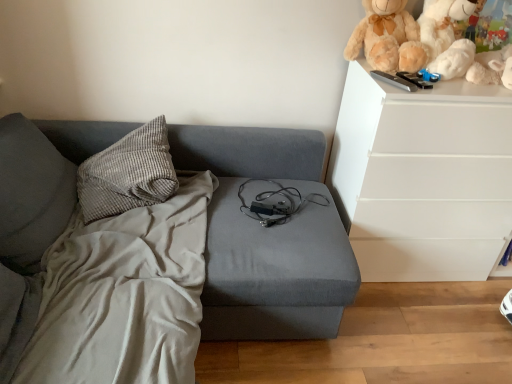
Describe the element at coordinates (460, 47) in the screenshot. This screenshot has height=384, width=512. I see `white plush toy at upper right` at that location.

What do you see at coordinates (387, 38) in the screenshot? I see `fluffy beige teddy bear at upper right` at bounding box center [387, 38].

Locate an element on the screen. The width and height of the screenshot is (512, 384). gray corduroy pillow at upper left is located at coordinates (128, 173).

Image resolution: width=512 pixels, height=384 pixels. Describe the element at coordinates (442, 23) in the screenshot. I see `white plush teddy bear at upper right` at that location.

Image resolution: width=512 pixels, height=384 pixels. Identify the location of white plush toy at upper right. (460, 47).

Which of these two, fluffy beige teddy bear at upper right or white plush toy at upper right, stands shorter?

Standing shorter between the two is fluffy beige teddy bear at upper right.

From a real-world perspective, is fluffy beige teddy bear at upper right physically above white plush toy at upper right?

Incorrect, from a real-world perspective, fluffy beige teddy bear at upper right is lower than white plush toy at upper right.

Is fluffy beige teddy bear at upper right far from white plush toy at upper right?

Actually, fluffy beige teddy bear at upper right and white plush toy at upper right are a little close together.

Based on their sizes in the image, would you say fluffy beige teddy bear at upper right is bigger or smaller than white plush toy at upper right?

fluffy beige teddy bear at upper right is smaller than white plush toy at upper right.

Is gray corduroy pillow at upper left turned away from white plush toy at upper right?

No, gray corduroy pillow at upper left is not facing the opposite direction of white plush toy at upper right.

Which is behind, gray corduroy pillow at upper left or white plush toy at upper right?

Positioned behind is white plush toy at upper right.

From a real-world perspective, which object stands above the other?

white plush toy at upper right.

Which of these two, gray corduroy pillow at upper left or white plush toy at upper right, stands shorter?

With less height is gray corduroy pillow at upper left.

Which is more to the left, white plush toy at upper right or white plush teddy bear at upper right?

white plush toy at upper right.

Is white plush toy at upper right wider than white plush teddy bear at upper right?

Correct, the width of white plush toy at upper right exceeds that of white plush teddy bear at upper right.

Considering the relative sizes of white plush toy at upper right and white plush teddy bear at upper right in the image provided, is white plush toy at upper right taller than white plush teddy bear at upper right?

Yes, white plush toy at upper right is taller than white plush teddy bear at upper right.

How many degrees apart are the facing directions of white plush toy at upper right and white plush teddy bear at upper right?

The angular difference between white plush toy at upper right and white plush teddy bear at upper right is 2.06 degrees.

Considering the positions of points (424, 43) and (161, 161), is point (424, 43) closer to camera compared to point (161, 161)?

Yes, it is in front of point (161, 161).

Could gray corduroy pillow at upper left be considered to be inside white plush teddy bear at upper right?

Definitely not — gray corduroy pillow at upper left is not inside white plush teddy bear at upper right.

I want to click on pillow below the white plush teddy bear at upper right (from the image's perspective), so click(128, 173).

Considering the relative sizes of white plush toy at upper right and fluffy beige teddy bear at upper right in the image provided, is white plush toy at upper right taller than fluffy beige teddy bear at upper right?

Yes, white plush toy at upper right is taller than fluffy beige teddy bear at upper right.

Between white plush toy at upper right and fluffy beige teddy bear at upper right, which one has larger size?

white plush toy at upper right.

Is point (361, 38) positioned after point (384, 41)?

Yes, it is.

From the image's perspective, would you say white plush toy at upper right is shown under fluffy beige teddy bear at upper right?

Yes.

Is gray corduroy pillow at upper left touching fluffy beige teddy bear at upper right?

gray corduroy pillow at upper left is not next to fluffy beige teddy bear at upper right, and they're not touching.

Can you tell me how much gray corduroy pillow at upper left and fluffy beige teddy bear at upper right differ in facing direction?

0.794 degrees separate the facing orientations of gray corduroy pillow at upper left and fluffy beige teddy bear at upper right.

Looking at this image, is gray corduroy pillow at upper left turned away from fluffy beige teddy bear at upper right?

No, gray corduroy pillow at upper left's orientation is not away from fluffy beige teddy bear at upper right.

From the image's perspective, is gray corduroy pillow at upper left above or below fluffy beige teddy bear at upper right?

gray corduroy pillow at upper left is situated lower than fluffy beige teddy bear at upper right in the image.

Is white plush toy at upper right next to gray corduroy pillow at upper left and touching it?

No, white plush toy at upper right is not beside gray corduroy pillow at upper left.

Can you confirm if white plush toy at upper right is thinner than gray corduroy pillow at upper left?

Yes.

Based on the photo, is white plush toy at upper right surrounding gray corduroy pillow at upper left?

No, gray corduroy pillow at upper left is not a part of white plush toy at upper right.

Considering the relative sizes of white plush toy at upper right and gray corduroy pillow at upper left in the image provided, is white plush toy at upper right bigger than gray corduroy pillow at upper left?

Incorrect, white plush toy at upper right is not larger than gray corduroy pillow at upper left.

I want to click on doll that is above the white plush toy at upper right (from the image's perspective), so click(x=387, y=38).

The image size is (512, 384). Find the location of `pillow lying on the left of white plush toy at upper right`. pillow lying on the left of white plush toy at upper right is located at coordinates (128, 173).

Estimate the real-world distances between objects in this image. Which object is further from gray corduroy pillow at upper left, fluffy beige teddy bear at upper right or white plush toy at upper right?

white plush toy at upper right.

Which object lies further to the anchor point gray corduroy pillow at upper left, white plush teddy bear at upper right or fluffy beige teddy bear at upper right?

white plush teddy bear at upper right is positioned further to the anchor gray corduroy pillow at upper left.

Estimate the real-world distances between objects in this image. Which object is further from gray corduroy pillow at upper left, white plush toy at upper right or fluffy beige teddy bear at upper right?

white plush toy at upper right.

Estimate the real-world distances between objects in this image. Which object is closer to white plush toy at upper right, white plush teddy bear at upper right or fluffy beige teddy bear at upper right?

Among the two, white plush teddy bear at upper right is located nearer to white plush toy at upper right.

Estimate the real-world distances between objects in this image. Which object is further from white plush toy at upper right, fluffy beige teddy bear at upper right or gray corduroy pillow at upper left?

Based on the image, gray corduroy pillow at upper left appears to be further to white plush toy at upper right.

From the image, which object appears to be farther from white plush toy at upper right, white plush teddy bear at upper right or gray corduroy pillow at upper left?

gray corduroy pillow at upper left is further to white plush toy at upper right.

Considering their positions, is gray corduroy pillow at upper left positioned closer to white plush teddy bear at upper right than white plush toy at upper right?

The object closer to white plush teddy bear at upper right is white plush toy at upper right.

Estimate the real-world distances between objects in this image. Which object is further from white plush toy at upper right, gray corduroy pillow at upper left or fluffy beige teddy bear at upper right?

gray corduroy pillow at upper left lies further to white plush toy at upper right than the other object.

Identify the location of toy between fluffy beige teddy bear at upper right and white plush teddy bear at upper right. (460, 47).

Locate an element on the screen. Image resolution: width=512 pixels, height=384 pixels. doll between gray corduroy pillow at upper left and white plush toy at upper right in the horizontal direction is located at coordinates (387, 38).

This screenshot has height=384, width=512. In order to click on doll between gray corduroy pillow at upper left and white plush teddy bear at upper right in the horizontal direction in this screenshot , I will do `click(387, 38)`.

Locate an element on the screen. This screenshot has width=512, height=384. toy situated between gray corduroy pillow at upper left and white plush teddy bear at upper right from left to right is located at coordinates (460, 47).